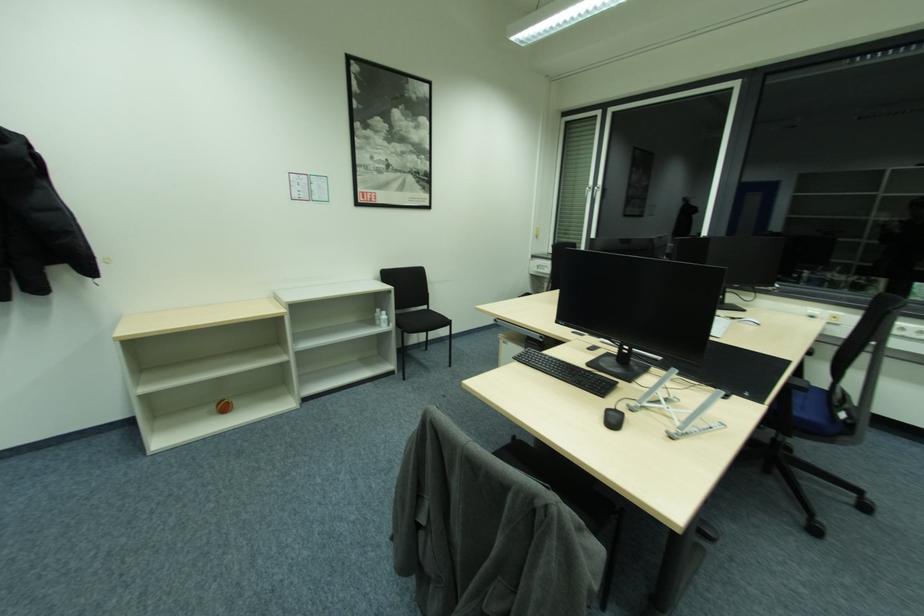
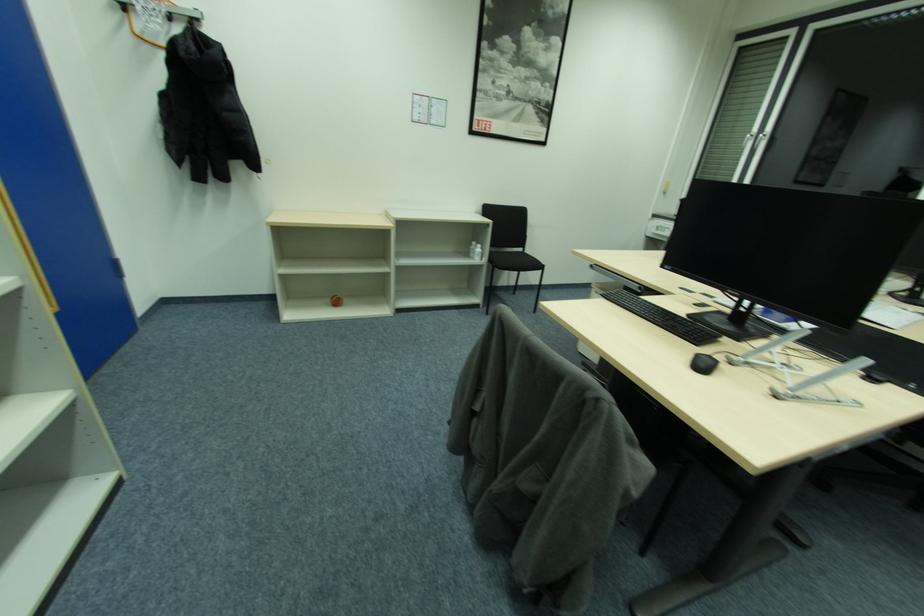
Question: What movement of the cameraman would produce the second image?

Choices:
 (A) Left
 (B) Right
 (C) Forward
 (D) Backward

Answer: (B)